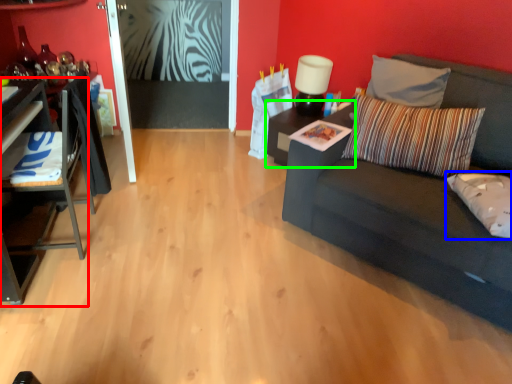
Question: Which object is positioned farthest from table (highlighted by a red box)? Select from pillow (highlighted by a blue box) and table (highlighted by a green box).

Choices:
 (A) pillow
 (B) table

Answer: (A)